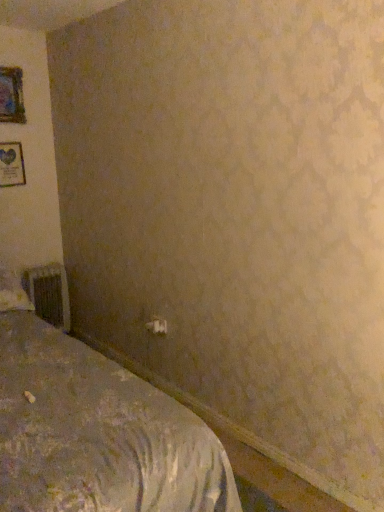
Question: Does metallic silver radiator at lower left appear on the right side of wooden picture frame at upper left, the second picture frame from the bottom?

Choices:
 (A) no
 (B) yes

Answer: (B)

Question: Considering the relative sizes of metallic silver radiator at lower left and wooden picture frame at upper left, arranged as the 1th picture frame when viewed from the top, in the image provided, is metallic silver radiator at lower left shorter than wooden picture frame at upper left, arranged as the 1th picture frame when viewed from the top,?

Choices:
 (A) no
 (B) yes

Answer: (A)

Question: Can you confirm if metallic silver radiator at lower left is taller than wooden picture frame at upper left, arranged as the 1th picture frame when viewed from the top?

Choices:
 (A) yes
 (B) no

Answer: (A)

Question: From a real-world perspective, is metallic silver radiator at lower left under wooden picture frame at upper left, arranged as the 1th picture frame when viewed from the top?

Choices:
 (A) no
 (B) yes

Answer: (B)

Question: Does metallic silver radiator at lower left come behind wooden picture frame at upper left, the second picture frame from the bottom?

Choices:
 (A) yes
 (B) no

Answer: (A)

Question: Is metallic silver radiator at lower left far away from wooden picture frame at upper left, arranged as the 1th picture frame when viewed from the top?

Choices:
 (A) no
 (B) yes

Answer: (B)

Question: Can you confirm if textured gray bed at lower left is bigger than wooden picture frame at upper left, the second picture frame from the bottom?

Choices:
 (A) yes
 (B) no

Answer: (A)

Question: Is textured gray bed at lower left in front of wooden picture frame at upper left, arranged as the 1th picture frame when viewed from the top?

Choices:
 (A) yes
 (B) no

Answer: (A)

Question: Does textured gray bed at lower left have a greater height compared to wooden picture frame at upper left, the second picture frame from the bottom?

Choices:
 (A) no
 (B) yes

Answer: (B)

Question: Can you confirm if textured gray bed at lower left is positioned to the right of wooden picture frame at upper left, the second picture frame from the bottom?

Choices:
 (A) yes
 (B) no

Answer: (A)

Question: From a real-world perspective, does textured gray bed at lower left sit lower than wooden picture frame at upper left, the second picture frame from the bottom?

Choices:
 (A) no
 (B) yes

Answer: (B)

Question: From a real-world perspective, does textured gray bed at lower left stand above wooden picture frame at upper left, arranged as the 1th picture frame when viewed from the top?

Choices:
 (A) no
 (B) yes

Answer: (A)

Question: Does white fabric pillow at left turn towards textured gray bed at lower left?

Choices:
 (A) no
 (B) yes

Answer: (B)